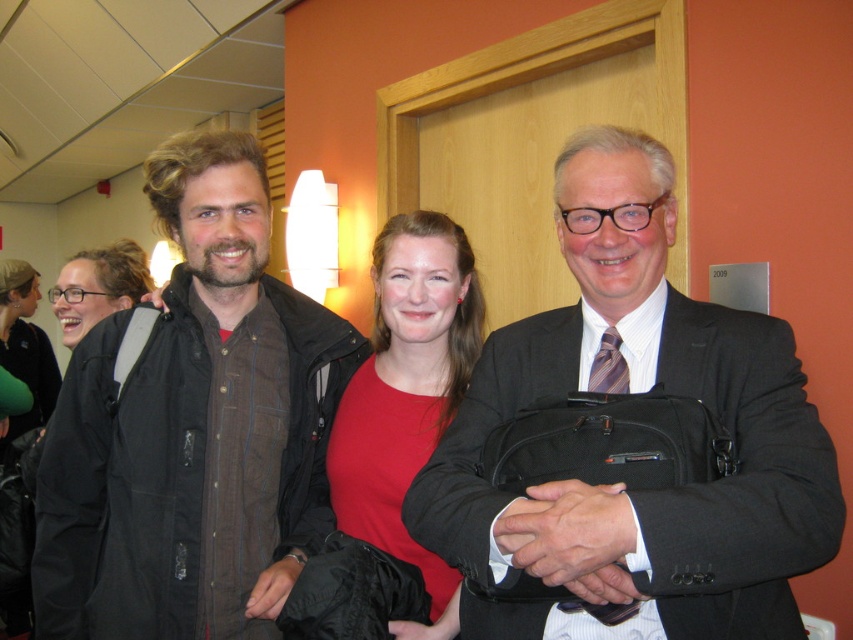
Question: Which object is the farthest from the matte black suit at center?

Choices:
 (A) brown textured jacket at left
 (B) black leather handbag at lower center
 (C) black leather handbag at center

Answer: (B)

Question: Is black leather handbag at center wider than black leather handbag at lower center?

Choices:
 (A) no
 (B) yes

Answer: (B)

Question: Which object is closer to the camera taking this photo?

Choices:
 (A) matte black suit at center
 (B) black leather handbag at lower center
 (C) brown textured jacket at left
 (D) matte red shirt at center

Answer: (A)

Question: Considering the relative positions of matte black suit at center and black leather handbag at center in the image provided, where is matte black suit at center located with respect to black leather handbag at center?

Choices:
 (A) below
 (B) above

Answer: (B)

Question: Which is nearer to the matte red shirt at center?

Choices:
 (A) brown textured jacket at left
 (B) matte black suit at center
 (C) black leather handbag at lower center

Answer: (A)

Question: Considering the relative positions of brown textured jacket at left and black leather handbag at center in the image provided, where is brown textured jacket at left located with respect to black leather handbag at center?

Choices:
 (A) left
 (B) right

Answer: (A)